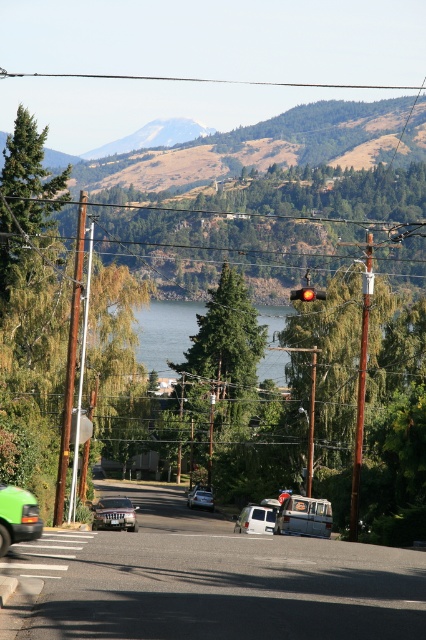
Question: Can you confirm if green textured tree at center is smaller than white matte van at center?

Choices:
 (A) no
 (B) yes

Answer: (A)

Question: Among these objects, which one is farthest from the camera?

Choices:
 (A) white matte van at center
 (B) silver metallic van at center
 (C) silver metallic suv at center
 (D) brown rocky mountain at upper center

Answer: (D)

Question: Does green textured tree at center come in front of red glass traffic light at center?

Choices:
 (A) no
 (B) yes

Answer: (A)

Question: Which of these objects is positioned closest to the brown wire at upper center?

Choices:
 (A) red glass traffic light at center
 (B) green textured tree at center
 (C) green matte van at lower left
 (D) brown rocky mountain at upper center

Answer: (D)

Question: Can you confirm if green water at center is smaller than silver metallic suv at center?

Choices:
 (A) no
 (B) yes

Answer: (A)

Question: Which point is farther from the camera taking this photo?

Choices:
 (A) (198, 497)
 (B) (321, 524)
 (C) (16, 493)
 (D) (112, 499)

Answer: (A)